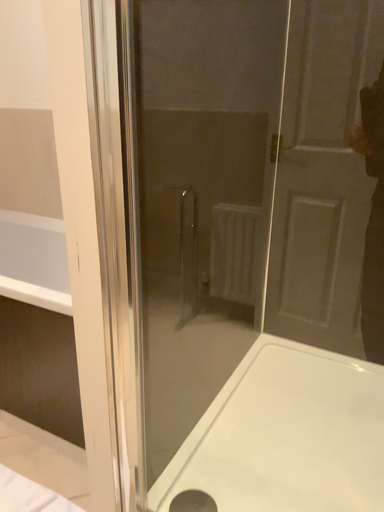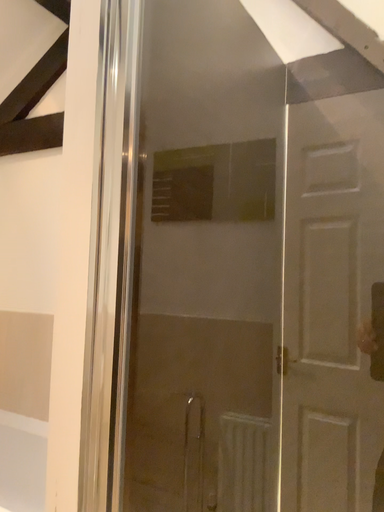
Question: Which way did the camera rotate in the video?

Choices:
 (A) rotated upward
 (B) rotated downward

Answer: (A)